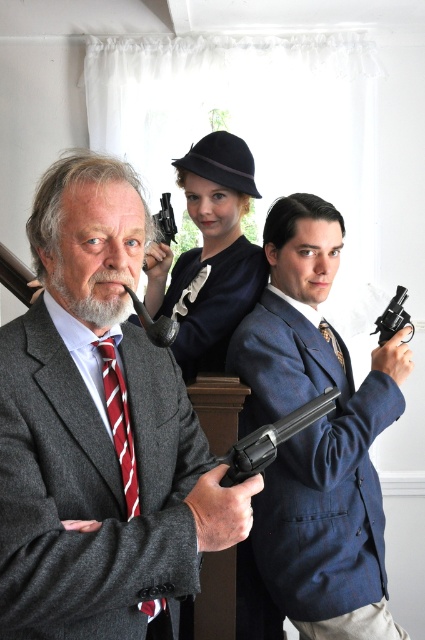
Which of these two, matte gray suit at center or striped silk tie at center, stands taller?

With more height is matte gray suit at center.

Who is more distant from viewer, [14,465] or [118,416]?

Positioned behind is point [118,416].

The image size is (425, 640). Find the location of `matte gray suit at center`. matte gray suit at center is located at coordinates (99, 433).

Is blue wool suit at center bigger than striped silk tie at center?

Indeed, blue wool suit at center has a larger size compared to striped silk tie at center.

The height and width of the screenshot is (640, 425). I want to click on blue wool suit at center, so click(317, 436).

The width and height of the screenshot is (425, 640). What do you see at coordinates (317, 436) in the screenshot?
I see `blue wool suit at center` at bounding box center [317, 436].

Identify the location of blue wool suit at center. The image size is (425, 640). (317, 436).

Is blue wool suit at center shorter than black metal revolver at right?

No, blue wool suit at center is not shorter than black metal revolver at right.

Is blue wool suit at center positioned in front of black metal revolver at right?

Yes, blue wool suit at center is closer to the viewer.

Locate an element on the screen. This screenshot has height=640, width=425. blue wool suit at center is located at coordinates point(317,436).